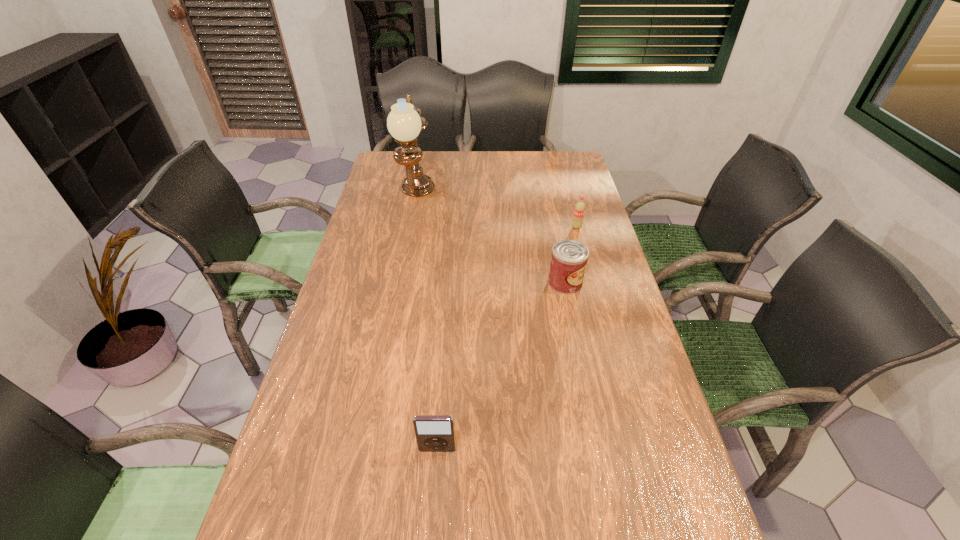
The width and height of the screenshot is (960, 540). Identify the location of empty location between the third object from left to right and the iPod. (501, 366).

Locate an element on the screen. object that is the closest to the can is located at coordinates (579, 210).

Identify which object is located as the third nearest to the tallest object. Please provide its 2D coordinates. Your answer should be formatted as a tuple, i.e. [(x, y)], where the tuple contains the x and y coordinates of a point satisfying the conditions above.

[(434, 433)]

The height and width of the screenshot is (540, 960). What are the coordinates of `vacant space that satisfies the following two spatial constraints: 1. on the front side of the rightmost object; 2. on the right side of the farthest object` in the screenshot? It's located at (411, 227).

You are a GUI agent. You are given a task and a screenshot of the screen. Output one action in this format:
    pyautogui.click(x=<x>, y=<y>)
    Task: Click on the vacant space that satisfies the following two spatial constraints: 1. on the front side of the oil lamp; 2. on the left side of the rightmost object
    The width and height of the screenshot is (960, 540).
    Given the screenshot: What is the action you would take?
    pyautogui.click(x=411, y=227)